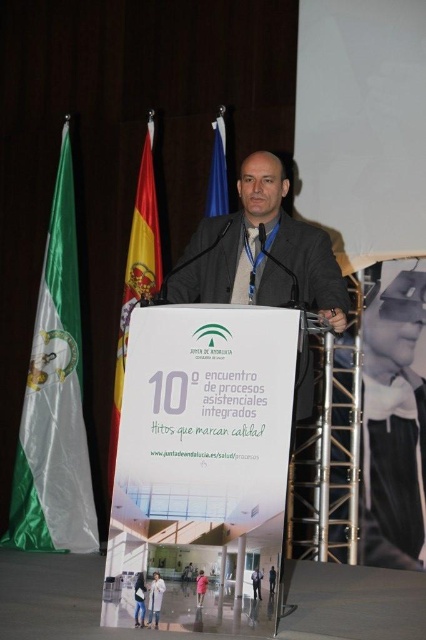
Who is lower down, blue fabric flag at upper center or matte black suit at center?

matte black suit at center

Identify the location of blue fabric flag at upper center. (218, 170).

The image size is (426, 640). What are the coordinates of `blue fabric flag at upper center` in the screenshot? It's located at (218, 170).

Does dark gray woolen suit at center have a greater width compared to matte black suit at center?

Correct, the width of dark gray woolen suit at center exceeds that of matte black suit at center.

Based on the photo, which of these two, dark gray woolen suit at center or matte black suit at center, stands shorter?

matte black suit at center

What are the coordinates of `dark gray woolen suit at center` in the screenshot? It's located at (302, 269).

Locate an element on the screen. The height and width of the screenshot is (640, 426). dark gray woolen suit at center is located at coordinates (302, 269).

Which of these two, green satin flag at left or matte black suit at center, stands taller?

green satin flag at left

Does green satin flag at left have a lesser height compared to matte black suit at center?

No.

Between point (46, 538) and point (270, 577), which one is positioned in front?

Point (270, 577)

Image resolution: width=426 pixels, height=640 pixels. In order to click on green satin flag at left in this screenshot , I will do `click(54, 400)`.